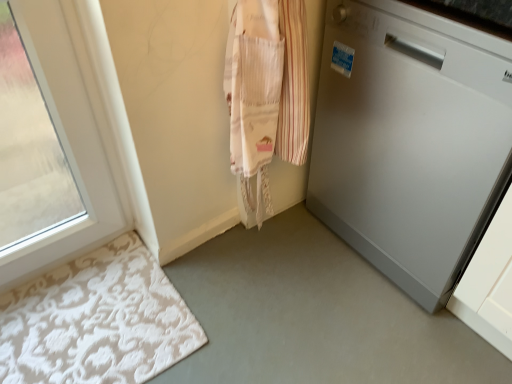
The width and height of the screenshot is (512, 384). What do you see at coordinates (96, 321) in the screenshot?
I see `white textured bath mat at lower left` at bounding box center [96, 321].

What are the coordinates of `white textured bath mat at lower left` in the screenshot? It's located at (96, 321).

Describe the element at coordinates (409, 139) in the screenshot. This screenshot has width=512, height=384. I see `white glossy dishwasher at right` at that location.

Identify the location of white glossy dishwasher at right. Image resolution: width=512 pixels, height=384 pixels. (409, 139).

Image resolution: width=512 pixels, height=384 pixels. Find the location of `white textured bath mat at lower left`. white textured bath mat at lower left is located at coordinates (96, 321).

Is white glossy dishwasher at right to the left of white textured bath mat at lower left from the viewer's perspective?

Incorrect, white glossy dishwasher at right is not on the left side of white textured bath mat at lower left.

Which object is closer to the camera, white glossy dishwasher at right or white textured bath mat at lower left?

white glossy dishwasher at right.

Is point (345, 0) in front of point (114, 292)?

Yes, point (345, 0) is in front of point (114, 292).

From the image's perspective, is white glossy dishwasher at right positioned above or below white textured bath mat at lower left?

white glossy dishwasher at right is above white textured bath mat at lower left.

From a real-world perspective, is white glossy dishwasher at right positioned above or below white textured bath mat at lower left?

Clearly, from a real-world perspective, white glossy dishwasher at right is above white textured bath mat at lower left.

In terms of width, does white glossy dishwasher at right look wider or thinner when compared to white textured bath mat at lower left?

white glossy dishwasher at right is wider than white textured bath mat at lower left.

Does white glossy dishwasher at right have a greater height compared to white textured bath mat at lower left?

Indeed, white glossy dishwasher at right has a greater height compared to white textured bath mat at lower left.

Considering the sizes of objects white glossy dishwasher at right and white textured bath mat at lower left in the image provided, who is smaller, white glossy dishwasher at right or white textured bath mat at lower left?

white textured bath mat at lower left is smaller.

Is white textured bath mat at lower left surrounded by white glossy dishwasher at right?

No.

Is white glossy dishwasher at right far away from white textured bath mat at lower left?

That's not correct — white glossy dishwasher at right is a little close to white textured bath mat at lower left.

Is white glossy dishwasher at right looking in the opposite direction of white textured bath mat at lower left?

No, white glossy dishwasher at right is not facing the opposite direction of white textured bath mat at lower left.

How distant is white glossy dishwasher at right from white textured bath mat at lower left?

white glossy dishwasher at right and white textured bath mat at lower left are 33.79 inches apart from each other.

Locate an element on the screen. The height and width of the screenshot is (384, 512). bath mat below the white glossy dishwasher at right (from a real-world perspective) is located at coordinates (96, 321).

Considering the relative positions of white textured bath mat at lower left and white glossy dishwasher at right in the image provided, is white textured bath mat at lower left to the right of white glossy dishwasher at right from the viewer's perspective?

Incorrect, white textured bath mat at lower left is not on the right side of white glossy dishwasher at right.

Which object is further away from the camera taking this photo, white textured bath mat at lower left or white glossy dishwasher at right?

white textured bath mat at lower left is more distant.

Which is further, (x=67, y=330) or (x=362, y=170)?

The point (x=362, y=170) is behind.

From the image's perspective, would you say white textured bath mat at lower left is positioned over white glossy dishwasher at right?

Actually, white textured bath mat at lower left appears below white glossy dishwasher at right in the image.

From a real-world perspective, who is located lower, white textured bath mat at lower left or white glossy dishwasher at right?

white textured bath mat at lower left is physically lower.

Can you confirm if white textured bath mat at lower left is wider than white glossy dishwasher at right?

No.

Who is taller, white textured bath mat at lower left or white glossy dishwasher at right?

white glossy dishwasher at right is taller.

Looking at the image, does white textured bath mat at lower left seem bigger or smaller compared to white glossy dishwasher at right?

Considering their sizes, white textured bath mat at lower left takes up less space than white glossy dishwasher at right.

Is white textured bath mat at lower left located outside white glossy dishwasher at right?

Indeed, white textured bath mat at lower left is completely outside white glossy dishwasher at right.

In the scene shown: Is white textured bath mat at lower left positioned far away from white glossy dishwasher at right?

No.

Is white textured bath mat at lower left oriented towards white glossy dishwasher at right?

No.

Looking at this image, how different are the orientations of white textured bath mat at lower left and white glossy dishwasher at right in degrees?

The angular difference between white textured bath mat at lower left and white glossy dishwasher at right is 90 degrees.

How far apart are white textured bath mat at lower left and white glossy dishwasher at right?

white textured bath mat at lower left and white glossy dishwasher at right are 33.79 inches apart from each other.

Identify the location of bath mat that is under the white glossy dishwasher at right (from a real-world perspective). (96, 321).

Where is `bath mat below the white glossy dishwasher at right (from the image's perspective)`? bath mat below the white glossy dishwasher at right (from the image's perspective) is located at coordinates (96, 321).

Where is `bath mat below the white glossy dishwasher at right (from a real-world perspective)`? Image resolution: width=512 pixels, height=384 pixels. bath mat below the white glossy dishwasher at right (from a real-world perspective) is located at coordinates (96, 321).